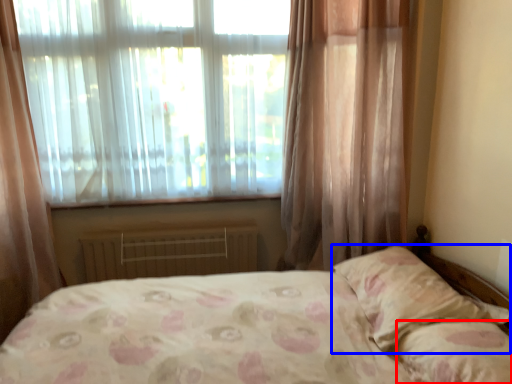
Question: Which object is further to the camera taking this photo, pillow (highlighted by a red box) or pillow (highlighted by a blue box)?

Choices:
 (A) pillow
 (B) pillow

Answer: (B)